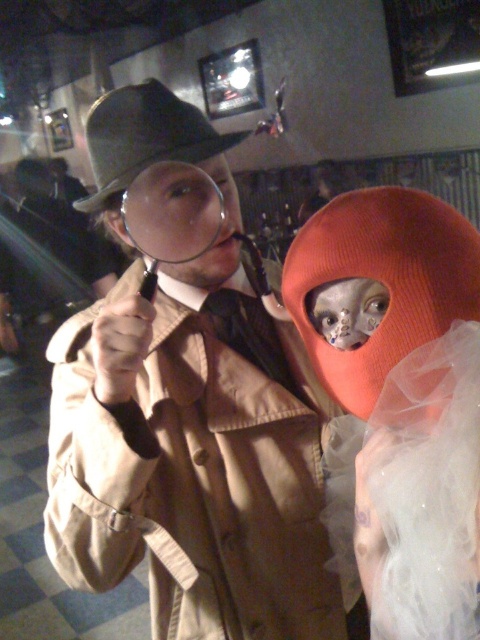
Based on the photo, can you confirm if brown leather trench coat at center is taller than orange knitted hat at center?

Yes, brown leather trench coat at center is taller than orange knitted hat at center.

Locate an element on the screen. The width and height of the screenshot is (480, 640). brown leather trench coat at center is located at coordinates (188, 417).

The width and height of the screenshot is (480, 640). What are the coordinates of `brown leather trench coat at center` in the screenshot? It's located at (188, 417).

Where is `brown leather trench coat at center`? This screenshot has width=480, height=640. brown leather trench coat at center is located at coordinates (188, 417).

Which of these two, brown leather trench coat at center or brown felt hat at upper left, stands shorter?

Standing shorter between the two is brown felt hat at upper left.

The image size is (480, 640). Describe the element at coordinates (188, 417) in the screenshot. I see `brown leather trench coat at center` at that location.

Is point (199, 525) farther from viewer compared to point (158, 147)?

Yes, it is behind point (158, 147).

Where is `brown leather trench coat at center`? This screenshot has width=480, height=640. brown leather trench coat at center is located at coordinates (188, 417).

Is orange knitted hat at center below brown felt hat at upper left?

Yes, orange knitted hat at center is below brown felt hat at upper left.

Is orange knitted hat at center wider than brown felt hat at upper left?

Incorrect, orange knitted hat at center's width does not surpass brown felt hat at upper left's.

Does point (308, 276) lie behind point (92, 161)?

No.

The width and height of the screenshot is (480, 640). What are the coordinates of `orange knitted hat at center` in the screenshot? It's located at (384, 278).